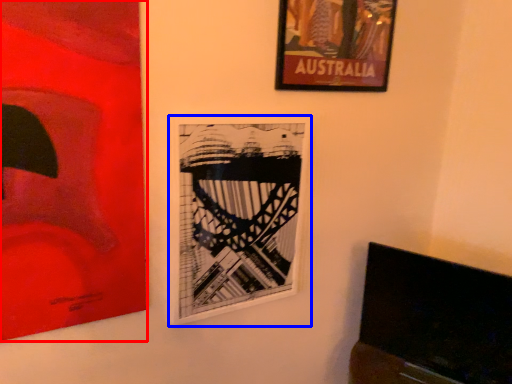
Question: Which object is further to the camera taking this photo, picture frame (highlighted by a red box) or picture frame (highlighted by a blue box)?

Choices:
 (A) picture frame
 (B) picture frame

Answer: (B)